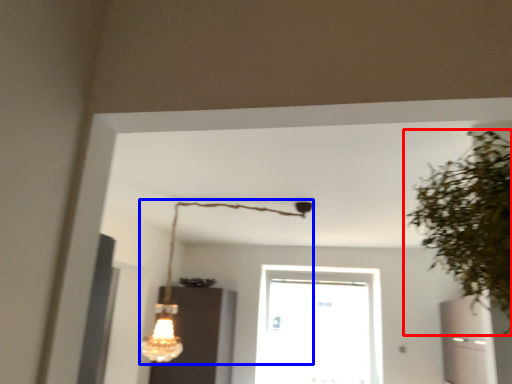
Question: Which of the following is the farthest to the observer, houseplant (highlighted by a red box) or lamp (highlighted by a blue box)?

Choices:
 (A) houseplant
 (B) lamp

Answer: (B)